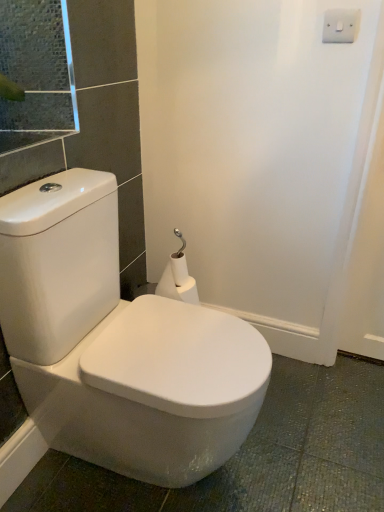
Where is `white glossy toilet at center`? The image size is (384, 512). white glossy toilet at center is located at coordinates (117, 343).

Locate an element on the screen. white plastic/light switch at upper right is located at coordinates (340, 26).

Considering the positions of points (14, 260) and (170, 286), is point (14, 260) closer to camera compared to point (170, 286)?

Yes, it is in front of point (170, 286).

Is white glossy toilet at center aimed at white matte toilet paper at center?

No, white glossy toilet at center does not turn towards white matte toilet paper at center.

Find the location of a particular element. The image size is (384, 512). toilet paper on the right of the white glossy toilet at center is located at coordinates (178, 281).

Locate an element on the screen. This screenshot has width=384, height=512. light switch above the white matte toilet paper at center (from a real-world perspective) is located at coordinates (340, 26).

Is white plastic/light switch at upper right facing away from white matte toilet paper at center?

No, white matte toilet paper at center is not at the back of white plastic/light switch at upper right.

From the image's perspective, is white plastic/light switch at upper right on white matte toilet paper at center?

Correct, white plastic/light switch at upper right appears higher than white matte toilet paper at center in the image.

Based on the photo, from the image's perspective, is white matte toilet paper at center beneath white glossy toilet at center?

No, from the image's perspective, white matte toilet paper at center is not beneath white glossy toilet at center.

Based on the photo, which object is closer to the camera taking this photo, white matte toilet paper at center or white glossy toilet at center?

white glossy toilet at center.

Is white matte toilet paper at center with white glossy toilet at center?

No, white matte toilet paper at center is not touching white glossy toilet at center.

Which point is more distant from viewer, [176,282] or [72,254]?

The point [176,282] is farther from the camera.

Can you tell me how much white plastic/light switch at upper right and white glossy toilet at center differ in facing direction?

They differ by 93.9 degrees in their facing directions.

Is white plastic/light switch at upper right at the right side of white glossy toilet at center?

Yes.

Between white plastic/light switch at upper right and white glossy toilet at center, which one has more height?

With more height is white glossy toilet at center.

Based on the photo, is white matte toilet paper at center not inside white plastic/light switch at upper right?

That's correct, white matte toilet paper at center is outside of white plastic/light switch at upper right.

Is point (174, 285) more distant than point (331, 12)?

Yes, point (174, 285) is behind point (331, 12).

From a real-world perspective, is white matte toilet paper at center below white plastic/light switch at upper right?

Yes, from a real-world perspective, white matte toilet paper at center is below white plastic/light switch at upper right.

Is white glossy toilet at center smaller than white plastic/light switch at upper right?

Actually, white glossy toilet at center might be larger than white plastic/light switch at upper right.

From a real-world perspective, is white glossy toilet at center positioned over white plastic/light switch at upper right based on gravity?

No.

What's the angular difference between white glossy toilet at center and white plastic/light switch at upper right's facing directions?

There is a 93.9-degree angle between the facing directions of white glossy toilet at center and white plastic/light switch at upper right.

Which point is more distant from viewer, (x=186, y=378) or (x=325, y=20)?

The point (x=325, y=20) is farther from the camera.

This screenshot has width=384, height=512. What are the coordinates of `toilet on the left of white matte toilet paper at center` in the screenshot? It's located at (117, 343).

Image resolution: width=384 pixels, height=512 pixels. In order to click on toilet paper behind the white plastic/light switch at upper right in this screenshot , I will do `click(178, 281)`.

In the scene shown: Which object lies nearer to the anchor point white glossy toilet at center, white plastic/light switch at upper right or white matte toilet paper at center?

white matte toilet paper at center is closer to white glossy toilet at center.

When comparing their distances from white glossy toilet at center, does white matte toilet paper at center or white plastic/light switch at upper right seem closer?

Among the two, white matte toilet paper at center is located nearer to white glossy toilet at center.

When comparing their distances from white plastic/light switch at upper right, does white glossy toilet at center or white matte toilet paper at center seem closer?

The object closer to white plastic/light switch at upper right is white matte toilet paper at center.

Which object lies further to the anchor point white matte toilet paper at center, white plastic/light switch at upper right or white glossy toilet at center?

white plastic/light switch at upper right lies further to white matte toilet paper at center than the other object.

Estimate the real-world distances between objects in this image. Which object is closer to white plastic/light switch at upper right, white matte toilet paper at center or white glossy toilet at center?

Among the two, white matte toilet paper at center is located nearer to white plastic/light switch at upper right.

Considering their positions, is white glossy toilet at center positioned closer to white matte toilet paper at center than white plastic/light switch at upper right?

white glossy toilet at center is positioned closer to the anchor white matte toilet paper at center.

Where is `toilet paper that lies between white plastic/light switch at upper right and white glossy toilet at center from top to bottom`? The width and height of the screenshot is (384, 512). toilet paper that lies between white plastic/light switch at upper right and white glossy toilet at center from top to bottom is located at coordinates (178, 281).